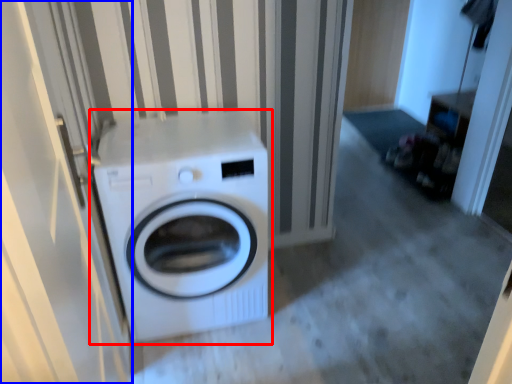
Question: Among these objects, which one is nearest to the camera, washing machine (highlighted by a red box) or screen door (highlighted by a blue box)?

Choices:
 (A) washing machine
 (B) screen door

Answer: (B)